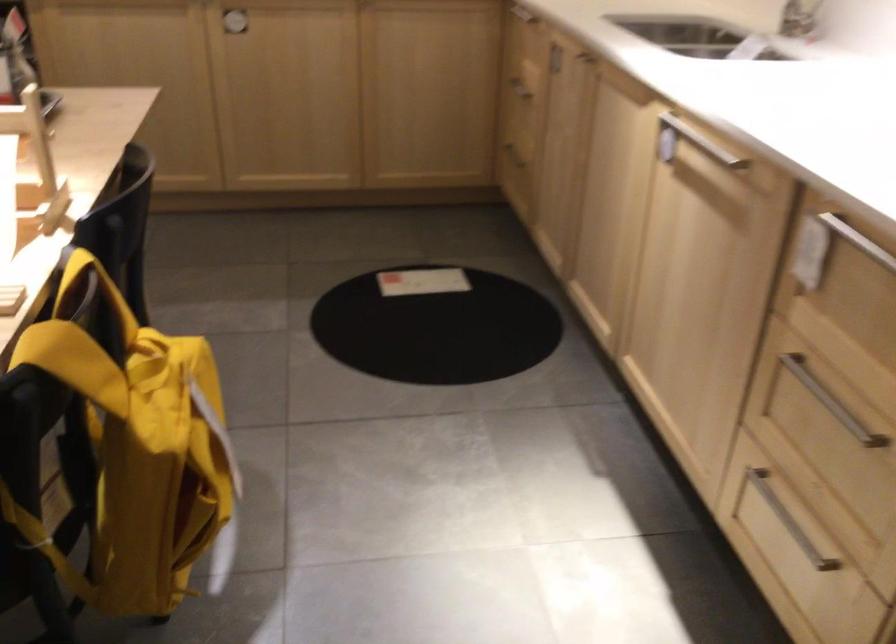
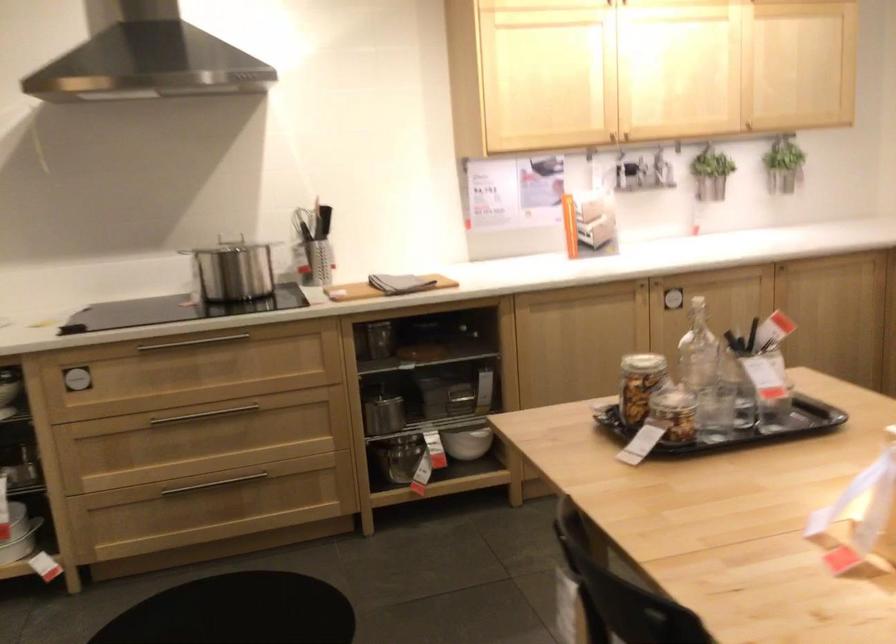
Question: Which direction would the cameraman need to move to produce the second image? Reply with the corresponding letter.

Choices:
 (A) Left
 (B) Right
 (C) Forward
 (D) Backward

Answer: (A)